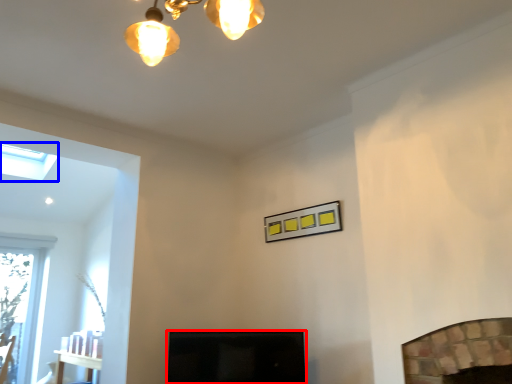
Question: Which point is closer to the camera, screen door (highlighted by a red box) or lamp (highlighted by a blue box)?

Choices:
 (A) screen door
 (B) lamp

Answer: (A)